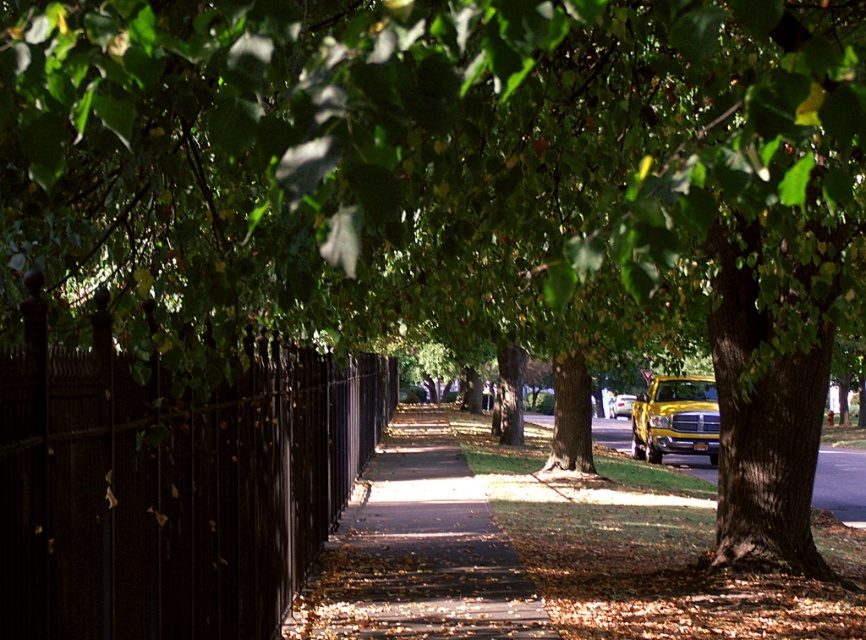
You are standing on the sidewalk in the suburban street scene. You notice two points marked in the image. Which point, point (347, 564) or point (618, 396), is closer to you?

Point (347, 564) is closer to the viewer than point (618, 396).

You are a delivery person who needs to park the yellow metallic truck at center on the brown concrete sidewalk at center. Based on the scene, can the truck fit on the sidewalk?

The brown concrete sidewalk at center is larger in size than yellow metallic truck at center, so yes, the truck can fit on the sidewalk.